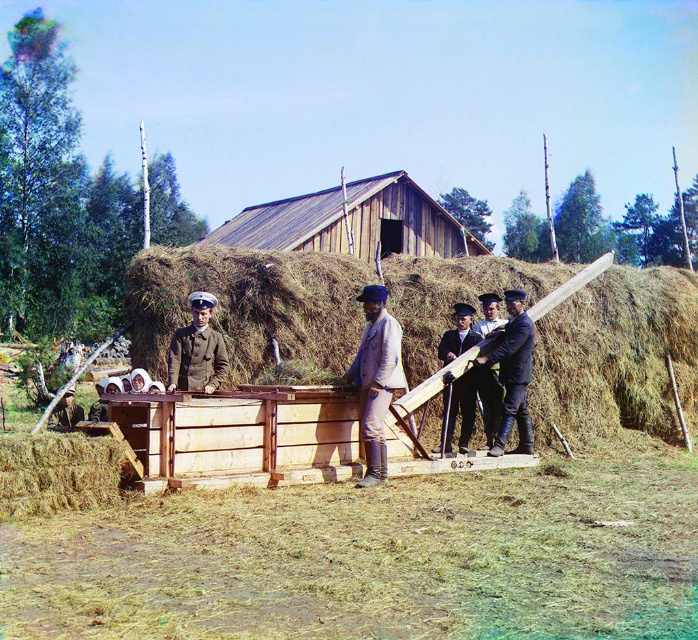
You are a photographer standing in front of the wagon. You notice the dark brown uniform at center and the brown leather hat at lower left. Which object is positioned higher in the image?

The dark brown uniform at center is located above the brown leather hat at lower left, so it is positioned higher in the image.